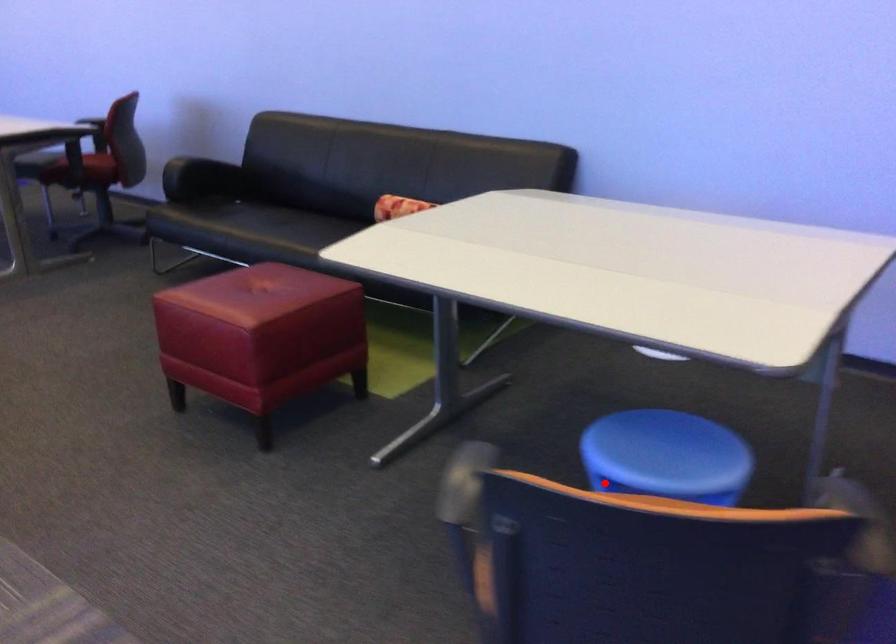
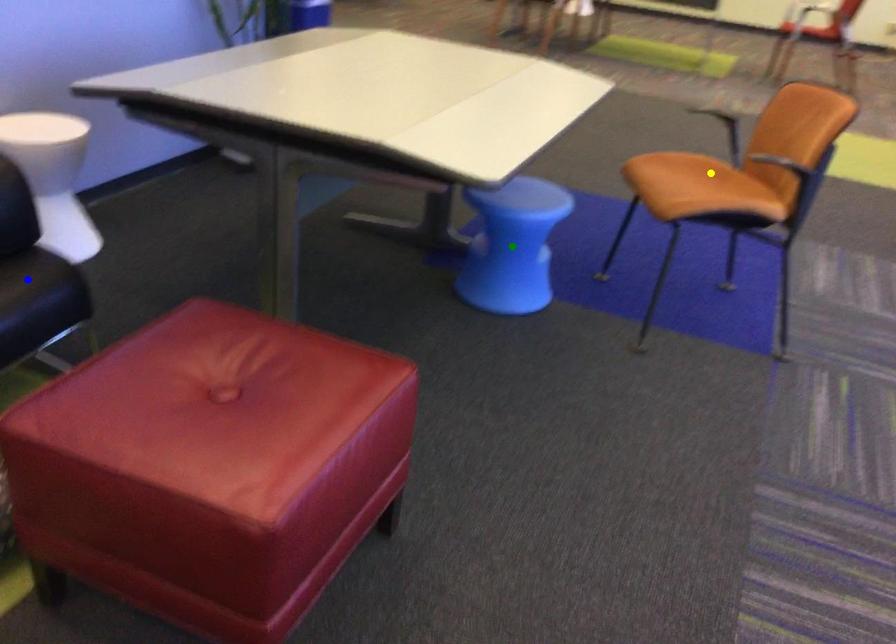
Question: I am providing you with two images of the same scene from different viewpoints. A red point is marked on the first image. You are given multiple points on the second image. Which spot in image 2 lines up with the point in image 1?

Choices:
 (A) blue point
 (B) yellow point
 (C) green point

Answer: (C)